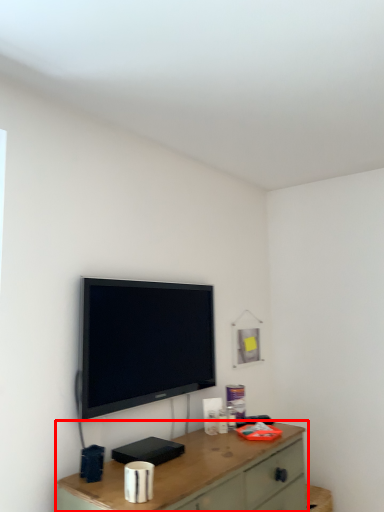
Question: Where is desk (annotated by the red box) located in relation to television in the image?

Choices:
 (A) right
 (B) left

Answer: (A)